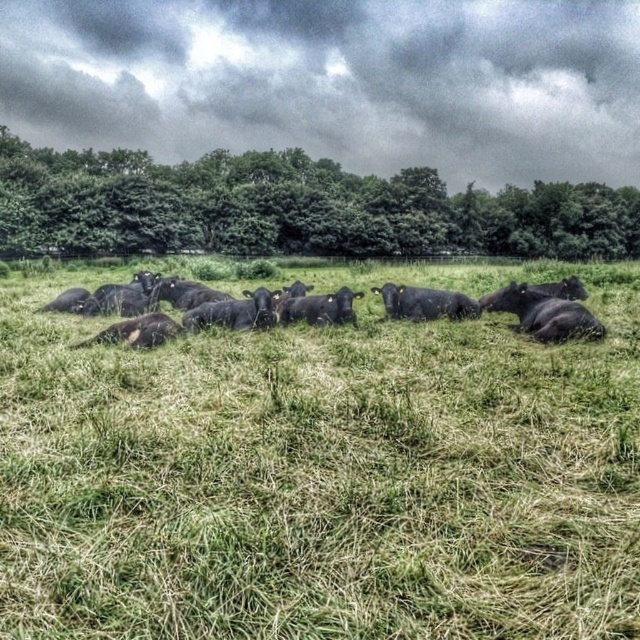
You are a farmer looking at the sky and the field. You see the dark gray cloud at upper center and the black matte cow at center. Which object is higher in the scene?

The dark gray cloud at upper center is higher than the black matte cow at center because it is positioned above it.

You are a farmer who wants to protect the black matte cow at center from the rain. The green leafy tree at upper center is above it. Can you use the tree to shelter the cow from the rain?

The green leafy tree at upper center is positioned over the black matte cow at center, so yes, the tree can provide shelter for the cow from the rain.

You are a farmer checking the field. You see the black grass at center and the black matte cows at center. Which one has a larger width?

The black grass at center might be wider than black matte cows at center.